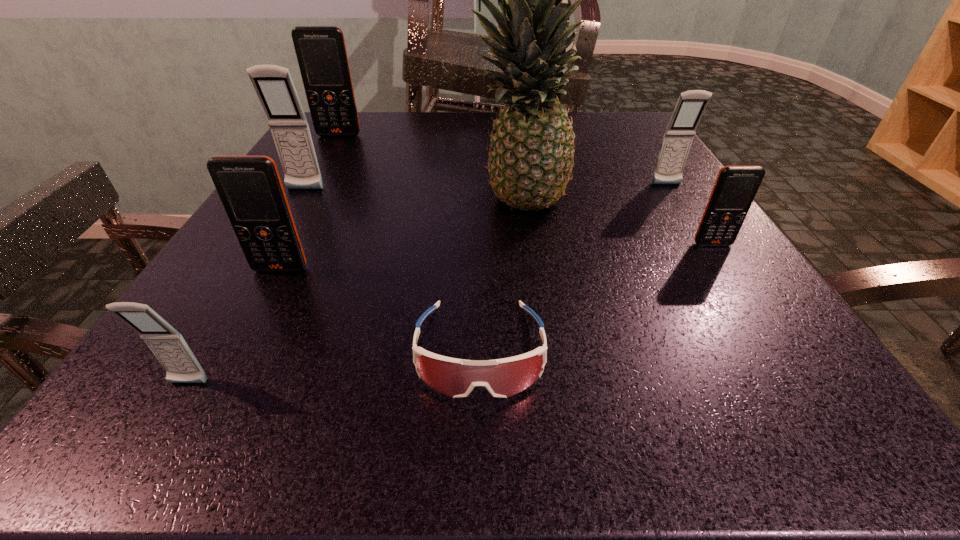
The width and height of the screenshot is (960, 540). In order to click on vacant area that lies between the third smallest orange cellular telephone and the second nearest cellular telephone in this screenshot , I will do `click(310, 202)`.

Image resolution: width=960 pixels, height=540 pixels. Find the location of `empty space between the second biggest orange cellular telephone and the farthest object`. empty space between the second biggest orange cellular telephone and the farthest object is located at coordinates (436, 130).

Choose which object is the third nearest neighbor to the eighth shortest object. Please provide its 2D coordinates. Your answer should be formatted as a tuple, i.e. [(x, y)], where the tuple contains the x and y coordinates of a point satisfying the conditions above.

[(321, 52)]

Locate which object is the fourth closest to the second nearest cellular telephone. Please provide its 2D coordinates. Your answer should be formatted as a tuple, i.e. [(x, y)], where the tuple contains the x and y coordinates of a point satisfying the conditions above.

[(530, 162)]

Find the location of a particular element. Image resolution: width=960 pixels, height=540 pixels. the fifth closest cellular telephone to the red goggles is located at coordinates (678, 137).

You are a GUI agent. You are given a task and a screenshot of the screen. Output one action in this format:
    pyautogui.click(x=<x>, y=<y>)
    Task: Click on the cellular telephone that is the second closest one to the biggest gray cellular telephone
    Image resolution: width=960 pixels, height=540 pixels.
    Given the screenshot: What is the action you would take?
    pyautogui.click(x=321, y=52)

The height and width of the screenshot is (540, 960). Find the location of `orange cellular telephone that is the third nearest to the biggest orange cellular telephone`. orange cellular telephone that is the third nearest to the biggest orange cellular telephone is located at coordinates (250, 188).

I want to click on orange cellular telephone that is the second closest to the rightmost gray cellular telephone, so click(x=557, y=0).

Where is `gray cellular telephone that stands as the closest to the second tallest object`? gray cellular telephone that stands as the closest to the second tallest object is located at coordinates [x=678, y=137].

Identify which gray cellular telephone is the third closest to the shortest object. Please provide its 2D coordinates. Your answer should be formatted as a tuple, i.e. [(x, y)], where the tuple contains the x and y coordinates of a point satisfying the conditions above.

[(678, 137)]